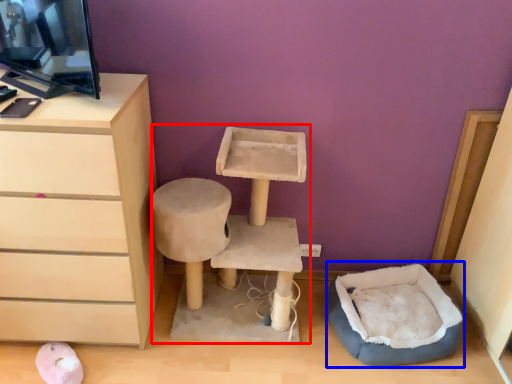
Question: Which point is further to the camera, vanity (highlighted by a red box) or bean bag chair (highlighted by a blue box)?

Choices:
 (A) vanity
 (B) bean bag chair

Answer: (B)